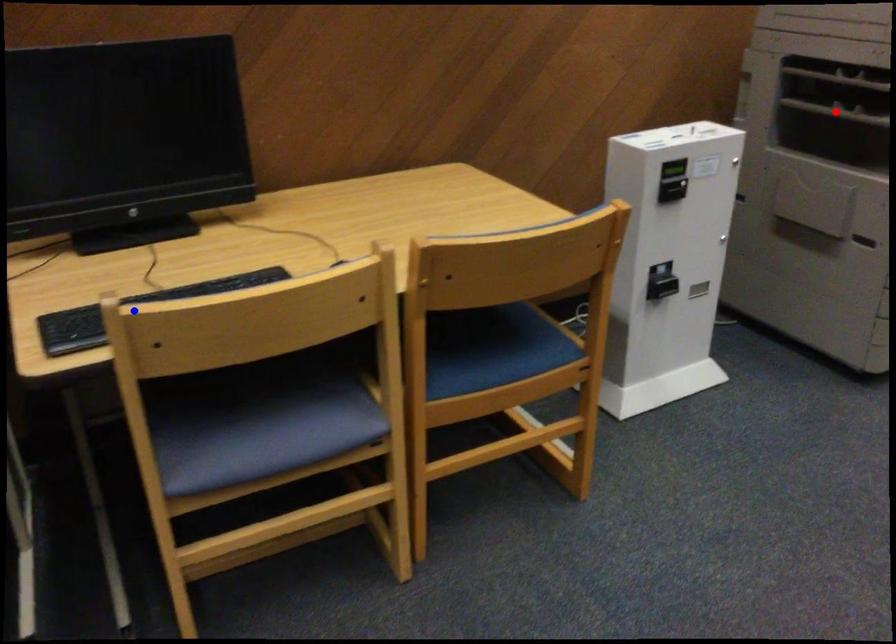
Question: Two points are marked on the image. Which point is closer to the camera?

Choices:
 (A) Blue point is closer.
 (B) Red point is closer.

Answer: (A)